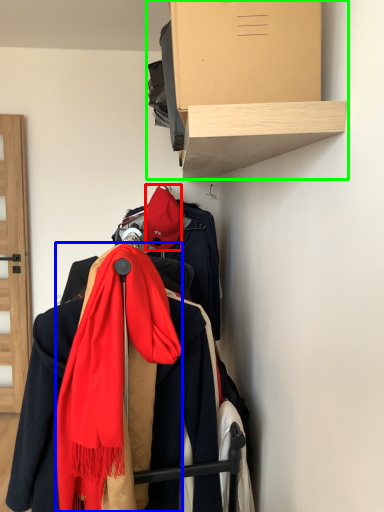
Question: Considering the real-world distances, which object is closest to hat (highlighted by a red box)? scarf (highlighted by a blue box) or shelf (highlighted by a green box).

Choices:
 (A) scarf
 (B) shelf

Answer: (B)